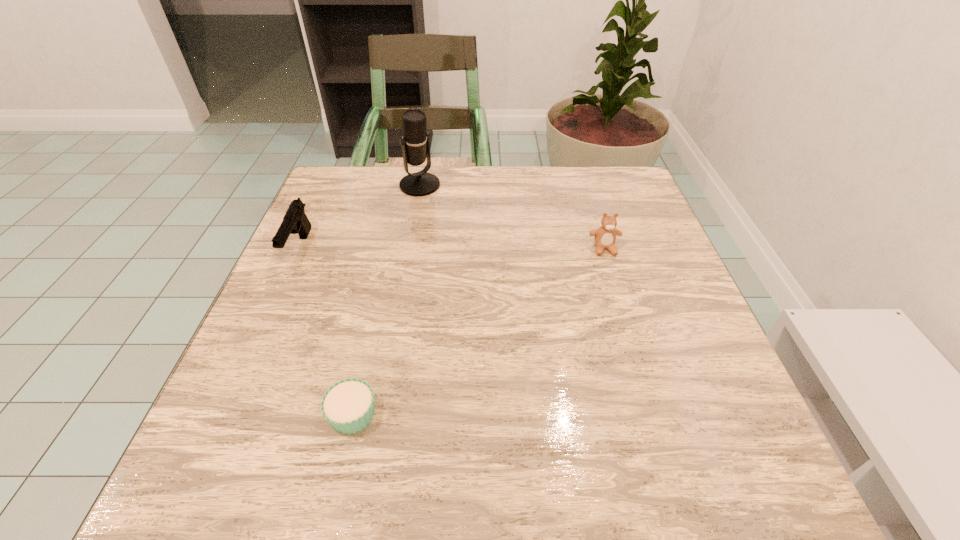
Where is `microphone`? This screenshot has height=540, width=960. microphone is located at coordinates click(x=415, y=145).

You are a GUI agent. You are given a task and a screenshot of the screen. Output one action in this format:
    pyautogui.click(x=<x>, y=<y>)
    Task: Click on the tallest object
    
    Given the screenshot: What is the action you would take?
    pyautogui.click(x=415, y=145)

At what (x,y) coordinates should I click in order to perform the action: click on pistol. Please return your answer as a coordinate pair (x, y). Looking at the image, I should click on (295, 221).

You are a GUI agent. You are given a task and a screenshot of the screen. Output one action in this format:
    pyautogui.click(x=<x>, y=<y>)
    Task: Click on the rightmost object
    The height and width of the screenshot is (540, 960).
    Given the screenshot: What is the action you would take?
    pyautogui.click(x=605, y=236)

Image resolution: width=960 pixels, height=540 pixels. Identify the location of cupcake. point(348,406).

Where is `the nearest object`? The height and width of the screenshot is (540, 960). the nearest object is located at coordinates (348, 406).

Where is `vacant region located 0.250m on the right of the microphone`? The image size is (960, 540). vacant region located 0.250m on the right of the microphone is located at coordinates (534, 185).

In order to click on vacant space situated 0.300m on the front-facing side of the pistol in this screenshot , I will do `click(229, 401)`.

Find the location of `blank space located 0.050m on the front-facing side of the teddy bear`. blank space located 0.050m on the front-facing side of the teddy bear is located at coordinates (612, 273).

Locate an element on the screen. free space located 0.390m on the right of the shortest object is located at coordinates (625, 414).